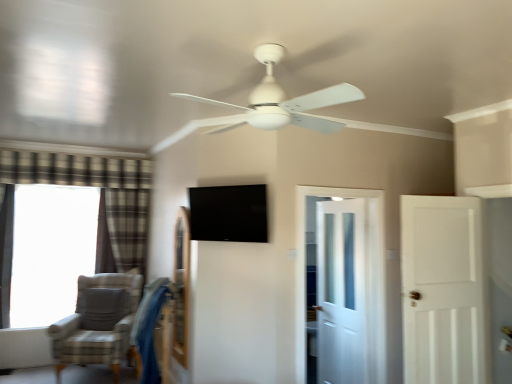
Measure the distance between point (x=114, y=253) and camera.

16.82 feet.

In order to face black glossy tv at center, should I rotate leftwards or rightwards?

Turn left approximately 3.759 degrees to face it.

At what (x,y) coordinates should I click in order to perform the action: click on white glossy door at center, which ranks as the first door in left-to-right order. Please return your answer as a coordinate pair (x, y). This screenshot has width=512, height=384. Looking at the image, I should click on (341, 291).

Measure the distance between point (101,336) and camera.

A distance of 14.02 feet exists between point (101,336) and camera.

Find the location of a particular element. The image size is (512, 384). gray fabric chair at lower left is located at coordinates (98, 323).

At what (x,y) coordinates should I click in order to perform the action: click on plaid fabric curtain at left, arranged as the first curtain when viewed from the right. Please return your answer as a coordinate pair (x, y). Looking at the image, I should click on (122, 230).

Is plaid fabric curtain at left, the 2th curtain viewed from the front, at the left side of white matte ceiling fan at center?

Yes, plaid fabric curtain at left, the 2th curtain viewed from the front, is to the left of white matte ceiling fan at center.

Where is `ceiling fan that appears on the right of plaid fabric curtain at left, arranged as the first curtain when viewed from the right`? The height and width of the screenshot is (384, 512). ceiling fan that appears on the right of plaid fabric curtain at left, arranged as the first curtain when viewed from the right is located at coordinates (284, 108).

Between plaid fabric curtain at left, which is the second curtain from left to right, and white matte ceiling fan at center, which one has smaller width?

plaid fabric curtain at left, which is the second curtain from left to right.

Is plaid fabric curtain at left, positioned as the first curtain in back-to-front order, shorter than white matte ceiling fan at center?

No.

Is black glossy tv at center surrounded by white glossy door at center, acting as the 2th door starting from the front?

No, black glossy tv at center is located outside of white glossy door at center, acting as the 2th door starting from the front.

Does white glossy door at center, which ranks as the first door in left-to-right order, have a lesser height compared to black glossy tv at center?

In fact, white glossy door at center, which ranks as the first door in left-to-right order, may be taller than black glossy tv at center.

Could you tell me if white matte ceiling fan at center is turned towards blue fabric swivel chair at lower left?

No.

Is white matte ceiling fan at center touching blue fabric swivel chair at lower left?

No, white matte ceiling fan at center is not touching blue fabric swivel chair at lower left.

Does white matte ceiling fan at center have a lesser height compared to blue fabric swivel chair at lower left?

Yes.

Is blue fabric swivel chair at lower left outside of transparent glass window at left?

Yes, blue fabric swivel chair at lower left is located beyond the bounds of transparent glass window at left.

From the image's perspective, is blue fabric swivel chair at lower left under transparent glass window at left?

Yes.

Considering the sizes of objects blue fabric swivel chair at lower left and transparent glass window at left in the image provided, who is wider, blue fabric swivel chair at lower left or transparent glass window at left?

blue fabric swivel chair at lower left.

Considering the positions of point (159, 285) and point (31, 313), is point (159, 285) closer or farther from the camera than point (31, 313)?

Point (159, 285) appears to be closer to the viewer than point (31, 313).

Considering the relative sizes of gray fabric chair at lower left and white glossy door at center, acting as the 2th door starting from the front, in the image provided, is gray fabric chair at lower left wider than white glossy door at center, acting as the 2th door starting from the front,?

Yes.

From a real-world perspective, which door is the 2nd one above the gray fabric chair at lower left? Please provide its 2D coordinates.

[(341, 291)]

Consider the image. From a real-world perspective, is gray fabric chair at lower left below white glossy door at center, which ranks as the first door in left-to-right order?

Correct, in the physical world, gray fabric chair at lower left is lower than white glossy door at center, which ranks as the first door in left-to-right order.

The width and height of the screenshot is (512, 384). I want to click on window above the gray fabric chair at lower left (from the image's perspective), so click(x=51, y=251).

Does gray fabric chair at lower left contain transparent glass window at left?

Definitely not — transparent glass window at left is not inside gray fabric chair at lower left.

How different are the orientations of gray fabric chair at lower left and transparent glass window at left in degrees?

They differ by 21.8 degrees in their facing directions.

Between point (99, 289) and point (26, 324), which one is positioned in front?

The point (26, 324) is more forward.

Choose the correct answer: Is white glossy door at center, the first door when ordered from back to front, inside plaid fabric curtain at left, the first curtain positioned from the front, or outside it?

white glossy door at center, the first door when ordered from back to front, cannot be found inside plaid fabric curtain at left, the first curtain positioned from the front.

How different are the orientations of white glossy door at center, the first door when ordered from back to front, and plaid fabric curtain at left, which is the first curtain in left-to-right order, in degrees?

white glossy door at center, the first door when ordered from back to front, and plaid fabric curtain at left, which is the first curtain in left-to-right order, are facing 90.4 degrees away from each other.

Based on their positions, is white glossy door at center, acting as the 2th door starting from the front, located to the left or right of plaid fabric curtain at left, which is the first curtain in left-to-right order?

white glossy door at center, acting as the 2th door starting from the front, is positioned on plaid fabric curtain at left, which is the first curtain in left-to-right order,'s right side.

Which object is wider, white glossy door at center, which ranks as the first door in left-to-right order, or plaid fabric curtain at left, arranged as the second curtain when viewed from the right?

With larger width is plaid fabric curtain at left, arranged as the second curtain when viewed from the right.

Where is `ceiling fan in front of the plaid fabric curtain at left, which is the second curtain from left to right`? This screenshot has height=384, width=512. ceiling fan in front of the plaid fabric curtain at left, which is the second curtain from left to right is located at coordinates (284, 108).

I want to click on door that appears behind the black glossy tv at center, so click(341, 291).

Estimate the real-world distances between objects in this image. Which object is further from blue fabric swivel chair at lower left, black glossy tv at center or transparent glass window at left?

The object further to blue fabric swivel chair at lower left is transparent glass window at left.

When comparing their distances from blue fabric swivel chair at lower left, does white matte door at right, the first door when ordered from right to left, or transparent glass window at left seem further?

white matte door at right, the first door when ordered from right to left, is positioned further to the anchor blue fabric swivel chair at lower left.

Which object lies further to the anchor point plaid fabric curtain at left, which is the second curtain from left to right, white matte ceiling fan at center or white matte door at right, which appears as the 1th door when viewed from the front?

white matte door at right, which appears as the 1th door when viewed from the front, is further to plaid fabric curtain at left, which is the second curtain from left to right.

Looking at the image, which one is located further to plaid fabric curtain at left, which is the second curtain from left to right, plaid fabric curtain at left, which ranks as the 2th curtain in back-to-front order, or white matte ceiling fan at center?

white matte ceiling fan at center is positioned further to the anchor plaid fabric curtain at left, which is the second curtain from left to right.

In the scene shown: Considering their positions, is white glossy door at center, the first door when ordered from back to front, positioned further to plaid fabric curtain at left, which is the first curtain in left-to-right order, than white matte ceiling fan at center?

white glossy door at center, the first door when ordered from back to front, is positioned further to the anchor plaid fabric curtain at left, which is the first curtain in left-to-right order.

When comparing their distances from white glossy door at center, acting as the 2th door starting from the front, does white matte door at right, which appears as the 1th door when viewed from the front, or gray fabric chair at lower left seem closer?

white matte door at right, which appears as the 1th door when viewed from the front, is positioned closer to the anchor white glossy door at center, acting as the 2th door starting from the front.

Looking at the image, which one is located closer to transparent glass window at left, gray fabric chair at lower left or black glossy tv at center?

gray fabric chair at lower left lies closer to transparent glass window at left than the other object.

Looking at the image, which one is located further to blue fabric swivel chair at lower left, black glossy tv at center or white glossy door at center, acting as the 2th door starting from the front?

white glossy door at center, acting as the 2th door starting from the front.

Find the location of a particular element. The image size is (512, 384). window screen between white matte ceiling fan at center and gray fabric chair at lower left in the front-back direction is located at coordinates (229, 213).

The height and width of the screenshot is (384, 512). What are the coordinates of `door between white matte ceiling fan at center and black glossy tv at center from front to back` in the screenshot? It's located at 443,290.

Find the location of a particular element. window screen situated between blue fabric swivel chair at lower left and white glossy door at center, which ranks as the first door in left-to-right order, from left to right is located at coordinates (229, 213).

I want to click on swivel chair located between plaid fabric curtain at left, which ranks as the 2th curtain in back-to-front order, and black glossy tv at center in the left-right direction, so click(148, 331).